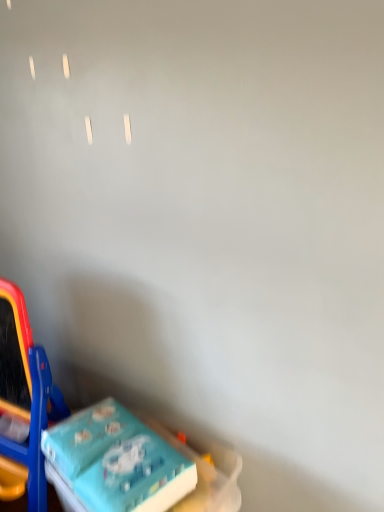
Describe the element at coordinates (24, 401) in the screenshot. This screenshot has height=512, width=384. I see `blue plastic easel at lower left, which is the 2th toy in right-to-left order` at that location.

This screenshot has height=512, width=384. What are the coordinates of `blue plastic easel at lower left, which is the 2th toy in right-to-left order` in the screenshot? It's located at (24, 401).

Image resolution: width=384 pixels, height=512 pixels. What do you see at coordinates (115, 462) in the screenshot?
I see `blue cardboard box at lower left, which appears as the second toy when viewed from the left` at bounding box center [115, 462].

Where is `blue cardboard box at lower left, the 1th toy viewed from the right`? The image size is (384, 512). blue cardboard box at lower left, the 1th toy viewed from the right is located at coordinates (115, 462).

What is the approximate width of blue cardboard box at lower left, the 1th toy viewed from the right?

It is 11.63 inches.

Measure the distance between blue cardboard box at lower left, the 1th toy viewed from the right, and camera.

The depth of blue cardboard box at lower left, the 1th toy viewed from the right, is 1.10 meters.

Identify the location of blue plastic easel at lower left, arranged as the first toy when viewed from the left. (24, 401).

Considering the relative positions of blue cardboard box at lower left, the 1th toy viewed from the right, and blue plastic easel at lower left, arranged as the first toy when viewed from the left, in the image provided, is blue cardboard box at lower left, the 1th toy viewed from the right, to the left or to the right of blue plastic easel at lower left, arranged as the first toy when viewed from the left,?

In the image, blue cardboard box at lower left, the 1th toy viewed from the right, appears on the right side of blue plastic easel at lower left, arranged as the first toy when viewed from the left.

In the image, is blue cardboard box at lower left, which appears as the second toy when viewed from the left, positioned in front of or behind blue plastic easel at lower left, which is the 2th toy in right-to-left order?

blue cardboard box at lower left, which appears as the second toy when viewed from the left, is positioned closer to the viewer than blue plastic easel at lower left, which is the 2th toy in right-to-left order.

Considering the points (94, 452) and (1, 468), which point is in front, point (94, 452) or point (1, 468)?

The point (94, 452) is more forward.

From the image's perspective, is blue cardboard box at lower left, which appears as the second toy when viewed from the left, on top of blue plastic easel at lower left, which is the 2th toy in right-to-left order?

Incorrect, from the image's perspective, blue cardboard box at lower left, which appears as the second toy when viewed from the left, is lower than blue plastic easel at lower left, which is the 2th toy in right-to-left order.

Looking at this image, from a real-world perspective, relative to blue plastic easel at lower left, which is the 2th toy in right-to-left order, is blue cardboard box at lower left, the 1th toy viewed from the right, vertically above or below?

From a real-world perspective, blue cardboard box at lower left, the 1th toy viewed from the right, is physically below blue plastic easel at lower left, which is the 2th toy in right-to-left order.

Which object is thinner, blue cardboard box at lower left, which appears as the second toy when viewed from the left, or blue plastic easel at lower left, arranged as the first toy when viewed from the left?

Thinner between the two is blue cardboard box at lower left, which appears as the second toy when viewed from the left.

Is blue cardboard box at lower left, which appears as the second toy when viewed from the left, taller or shorter than blue plastic easel at lower left, which is the 2th toy in right-to-left order?

blue cardboard box at lower left, which appears as the second toy when viewed from the left, is shorter than blue plastic easel at lower left, which is the 2th toy in right-to-left order.

Considering the sizes of objects blue cardboard box at lower left, the 1th toy viewed from the right, and blue plastic easel at lower left, which is the 2th toy in right-to-left order, in the image provided, who is bigger, blue cardboard box at lower left, the 1th toy viewed from the right, or blue plastic easel at lower left, which is the 2th toy in right-to-left order,?

blue plastic easel at lower left, which is the 2th toy in right-to-left order, is bigger.

Is blue cardboard box at lower left, the 1th toy viewed from the right, spatially inside blue plastic easel at lower left, arranged as the first toy when viewed from the left, or outside of it?

blue cardboard box at lower left, the 1th toy viewed from the right, lies outside blue plastic easel at lower left, arranged as the first toy when viewed from the left.

Can you see blue cardboard box at lower left, which appears as the second toy when viewed from the left, touching blue plastic easel at lower left, arranged as the first toy when viewed from the left?

No, blue cardboard box at lower left, which appears as the second toy when viewed from the left, is not next to blue plastic easel at lower left, arranged as the first toy when viewed from the left.

Is blue plastic easel at lower left, arranged as the first toy when viewed from the left, at the back of blue cardboard box at lower left, the 1th toy viewed from the right?

No, blue plastic easel at lower left, arranged as the first toy when viewed from the left, is not at the back of blue cardboard box at lower left, the 1th toy viewed from the right.

The width and height of the screenshot is (384, 512). In order to click on toy in front of the blue plastic easel at lower left, which is the 2th toy in right-to-left order in this screenshot , I will do pos(115,462).

Considering the relative positions of blue plastic easel at lower left, arranged as the first toy when viewed from the left, and blue cardboard box at lower left, which appears as the second toy when viewed from the left, in the image provided, is blue plastic easel at lower left, arranged as the first toy when viewed from the left, to the left of blue cardboard box at lower left, which appears as the second toy when viewed from the left, from the viewer's perspective?

Yes.

Is blue plastic easel at lower left, which is the 2th toy in right-to-left order, further to the viewer compared to blue cardboard box at lower left, the 1th toy viewed from the right?

Yes, blue plastic easel at lower left, which is the 2th toy in right-to-left order, is behind blue cardboard box at lower left, the 1th toy viewed from the right.

Considering the points (39, 507) and (99, 497), which point is behind, point (39, 507) or point (99, 497)?

The point (39, 507) is behind.

From the image's perspective, is blue plastic easel at lower left, which is the 2th toy in right-to-left order, beneath blue cardboard box at lower left, which appears as the second toy when viewed from the left?

No.

From a real-world perspective, is blue plastic easel at lower left, arranged as the first toy when viewed from the left, positioned under blue cardboard box at lower left, the 1th toy viewed from the right, based on gravity?

No, from a real-world perspective, blue plastic easel at lower left, arranged as the first toy when viewed from the left, is not beneath blue cardboard box at lower left, the 1th toy viewed from the right.

Between blue plastic easel at lower left, arranged as the first toy when viewed from the left, and blue cardboard box at lower left, the 1th toy viewed from the right, which one has larger width?

blue plastic easel at lower left, arranged as the first toy when viewed from the left.

Who is shorter, blue plastic easel at lower left, which is the 2th toy in right-to-left order, or blue cardboard box at lower left, the 1th toy viewed from the right?

blue cardboard box at lower left, the 1th toy viewed from the right, is shorter.

Based on the photo, does blue plastic easel at lower left, arranged as the first toy when viewed from the left, have a larger size compared to blue cardboard box at lower left, the 1th toy viewed from the right?

Yes, blue plastic easel at lower left, arranged as the first toy when viewed from the left, is bigger than blue cardboard box at lower left, the 1th toy viewed from the right.

Would you say blue plastic easel at lower left, which is the 2th toy in right-to-left order, is outside blue cardboard box at lower left, which appears as the second toy when viewed from the left?

Absolutely, blue plastic easel at lower left, which is the 2th toy in right-to-left order, is external to blue cardboard box at lower left, which appears as the second toy when viewed from the left.

Is blue plastic easel at lower left, which is the 2th toy in right-to-left order, next to blue cardboard box at lower left, which appears as the second toy when viewed from the left, and touching it?

blue plastic easel at lower left, which is the 2th toy in right-to-left order, is not next to blue cardboard box at lower left, which appears as the second toy when viewed from the left, and they're not touching.

Could you tell me if blue plastic easel at lower left, arranged as the first toy when viewed from the left, is facing blue cardboard box at lower left, the 1th toy viewed from the right?

No, blue plastic easel at lower left, arranged as the first toy when viewed from the left, is not aimed at blue cardboard box at lower left, the 1th toy viewed from the right.

Based on the photo, how many degrees apart are the facing directions of blue plastic easel at lower left, arranged as the first toy when viewed from the left, and blue cardboard box at lower left, which appears as the second toy when viewed from the left?

blue plastic easel at lower left, arranged as the first toy when viewed from the left, and blue cardboard box at lower left, which appears as the second toy when viewed from the left, are facing 18.6 degrees away from each other.

The height and width of the screenshot is (512, 384). I want to click on toy behind the blue cardboard box at lower left, the 1th toy viewed from the right, so click(24, 401).

Where is `toy in front of the blue plastic easel at lower left, which is the 2th toy in right-to-left order`? toy in front of the blue plastic easel at lower left, which is the 2th toy in right-to-left order is located at coordinates (115, 462).

The width and height of the screenshot is (384, 512). Identify the location of toy to the left of blue cardboard box at lower left, which appears as the second toy when viewed from the left. (24, 401).